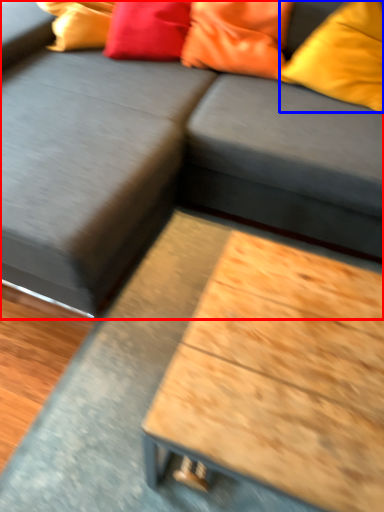
Question: Which object is further to the camera taking this photo, studio couch (highlighted by a red box) or pillow (highlighted by a blue box)?

Choices:
 (A) studio couch
 (B) pillow

Answer: (B)